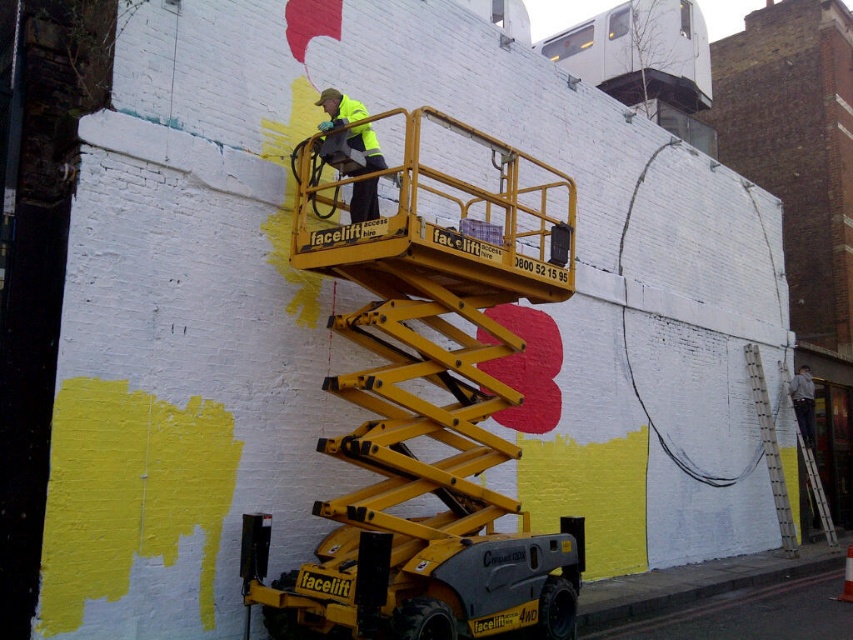
Can you confirm if yellow metallic scissor lift at center is positioned to the left of white plastic ladder at right?

Yes, yellow metallic scissor lift at center is to the left of white plastic ladder at right.

Based on the photo, between yellow metallic scissor lift at center and white plastic ladder at right, which one has less height?

white plastic ladder at right

Is point (572, 611) farther from camera compared to point (779, 513)?

That is False.

I want to click on yellow metallic scissor lift at center, so click(x=426, y=417).

Measure the distance between yellow metallic scissor lift at center and high visibility yellow jacket at center.

They are 4.69 feet apart.

Can you confirm if yellow metallic scissor lift at center is thinner than high visibility yellow jacket at center?

Incorrect, yellow metallic scissor lift at center's width is not less than high visibility yellow jacket at center's.

This screenshot has width=853, height=640. What are the coordinates of `yellow metallic scissor lift at center` in the screenshot? It's located at (426, 417).

I want to click on yellow metallic scissor lift at center, so click(x=426, y=417).

Is the position of high visibility yellow jacket at center less distant than that of white plastic ladder at right?

Yes, it is in front of white plastic ladder at right.

Which is behind, point (341, 100) or point (763, 445)?

Point (763, 445)

The height and width of the screenshot is (640, 853). I want to click on high visibility yellow jacket at center, so click(x=338, y=108).